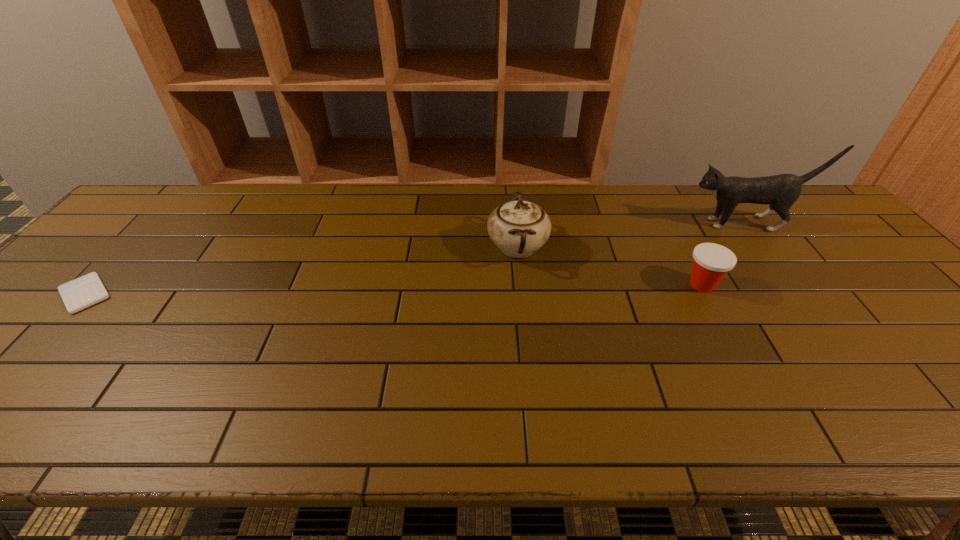
Select which object appears as the third closest to the chinaware. Please provide its 2D coordinates. Your answer should be formatted as a tuple, i.e. [(x, y)], where the tuple contains the x and y coordinates of a point satisfying the conditions above.

[(78, 294)]

This screenshot has height=540, width=960. Identify the location of the closest object relative to the Dixie cup. (781, 191).

This screenshot has height=540, width=960. I want to click on free location that satisfies the following two spatial constraints: 1. at the face of the cat; 2. on the front side of the Dixie cup, so click(x=791, y=285).

At what (x,y) coordinates should I click in order to perform the action: click on free space that satisfies the following two spatial constraints: 1. at the face of the tallest object; 2. on the front side of the chinaware. Please return your answer as a coordinate pair (x, y). This screenshot has width=960, height=540. Looking at the image, I should click on (763, 247).

Where is `free location that satisfies the following two spatial constraints: 1. on the front side of the third tallest object; 2. on the left side of the third object from right to left`? The height and width of the screenshot is (540, 960). free location that satisfies the following two spatial constraints: 1. on the front side of the third tallest object; 2. on the left side of the third object from right to left is located at coordinates (521, 285).

Find the location of `free space that satisfies the following two spatial constraints: 1. at the face of the tallest object; 2. on the front side of the chinaware`. free space that satisfies the following two spatial constraints: 1. at the face of the tallest object; 2. on the front side of the chinaware is located at coordinates (763, 247).